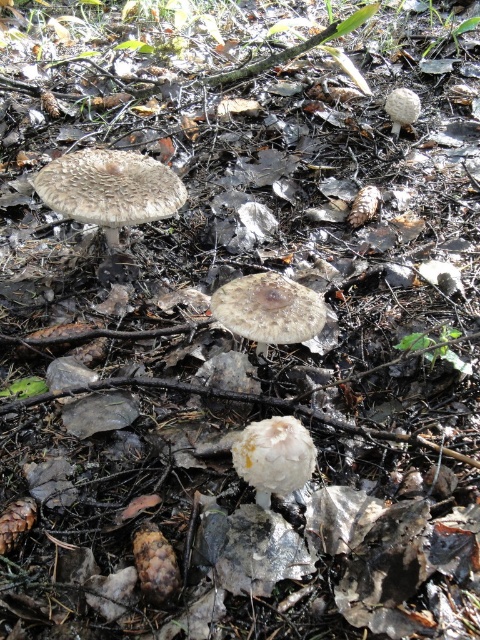
Question: Does white fuzzy mushroom at upper left appear under white fuzzy mushroom at upper right?

Choices:
 (A) no
 (B) yes

Answer: (B)

Question: Which is farther from the brown textured mushroom at center?

Choices:
 (A) white fuzzy mushroom at upper left
 (B) white fuzzy mushroom at upper right

Answer: (B)

Question: Does white fuzzy mushroom at upper left have a greater width compared to brown textured mushroom at center?

Choices:
 (A) yes
 (B) no

Answer: (A)

Question: Based on their relative distances, which object is farther from the brown textured mushroom at center?

Choices:
 (A) white fuzzy mushroom at center
 (B) white fuzzy mushroom at upper left
 (C) white fuzzy mushroom at upper right

Answer: (C)

Question: Is white fuzzy mushroom at center wider than white fuzzy mushroom at upper right?

Choices:
 (A) yes
 (B) no

Answer: (A)

Question: Which object is closer to the camera taking this photo?

Choices:
 (A) white fuzzy mushroom at upper right
 (B) brown textured mushroom at center
 (C) white fuzzy mushroom at upper left
 (D) white fuzzy mushroom at center

Answer: (D)